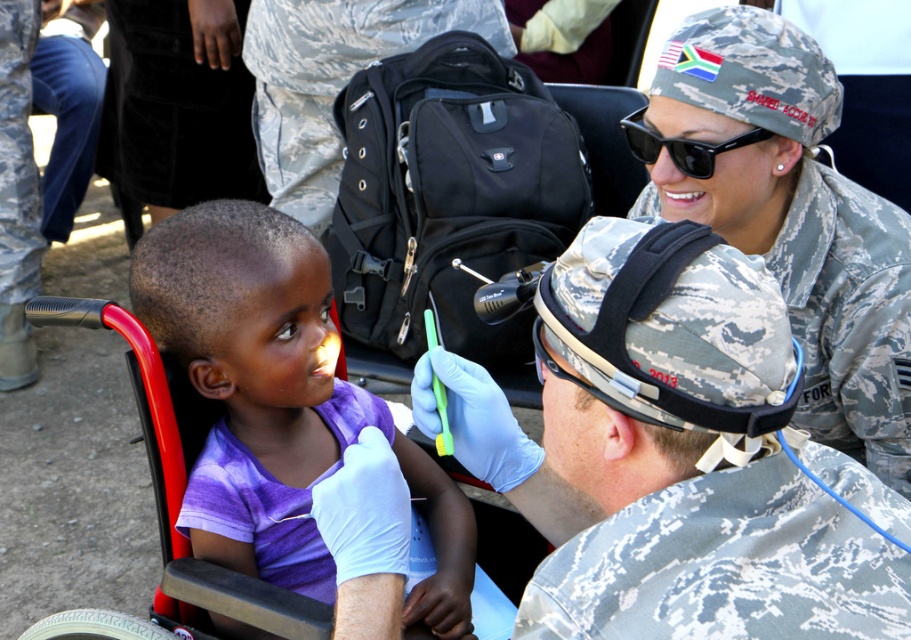
In the scene shown: Can you confirm if camouflage fabric helmet at center is smaller than purple cotton shirt at center?

Yes, camouflage fabric helmet at center is smaller than purple cotton shirt at center.

This screenshot has height=640, width=911. I want to click on camouflage fabric helmet at center, so click(667, 460).

Does camouflage fabric helmet at center have a greater height compared to black matte sunglasses at upper center?

Yes, camouflage fabric helmet at center is taller than black matte sunglasses at upper center.

Does camouflage fabric helmet at center have a greater width compared to black matte sunglasses at upper center?

Yes, camouflage fabric helmet at center is wider than black matte sunglasses at upper center.

Who is more forward, (492, 474) or (659, 134)?

Point (492, 474)

I want to click on camouflage fabric helmet at center, so [667, 460].

Which is more to the left, camouflage fabric helmet at center or camouflage uniform at upper right?

Positioned to the left is camouflage fabric helmet at center.

Does camouflage fabric helmet at center appear on the left side of camouflage uniform at upper right?

Indeed, camouflage fabric helmet at center is positioned on the left side of camouflage uniform at upper right.

What are the coordinates of `camouflage fabric helmet at center` in the screenshot? It's located at (667, 460).

The image size is (911, 640). What are the coordinates of `camouflage fabric helmet at center` in the screenshot? It's located at (667, 460).